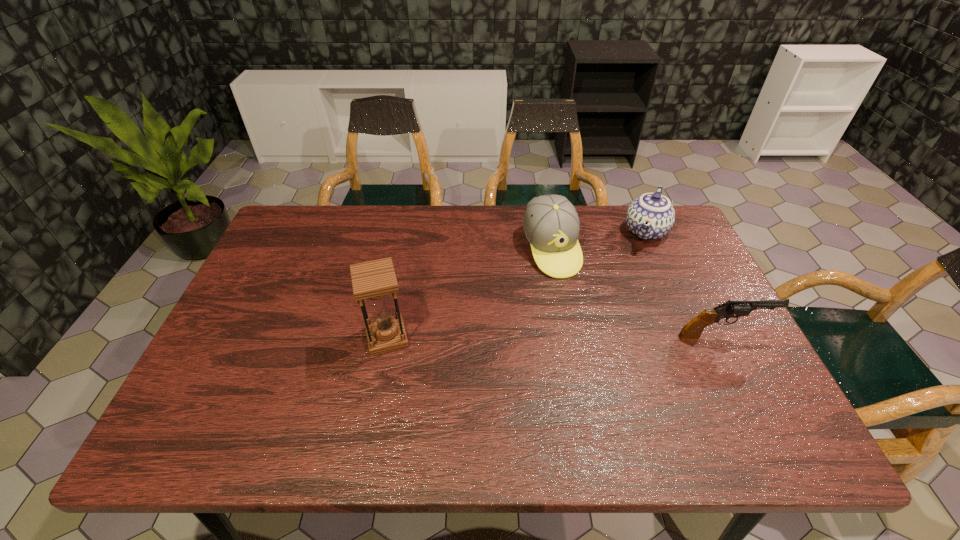
The height and width of the screenshot is (540, 960). What are the coordinates of `vacant space at the right edge of the desktop` in the screenshot? It's located at (681, 276).

At what (x,y) coordinates should I click in order to perform the action: click on vacant area at the far left corner of the desktop. Please return your answer as a coordinate pair (x, y). Looking at the image, I should click on (276, 252).

Identify the location of vacant space at the near left corner of the desktop. The width and height of the screenshot is (960, 540). (264, 375).

This screenshot has height=540, width=960. I want to click on free space between the baseball cap and the chinaware, so click(x=598, y=240).

You are a GUI agent. You are given a task and a screenshot of the screen. Output one action in this format:
    pyautogui.click(x=<x>, y=<y>)
    Task: Click on the free space between the gun and the tallest object
    Image resolution: width=960 pixels, height=540 pixels.
    Given the screenshot: What is the action you would take?
    pyautogui.click(x=555, y=337)

Find the location of a particular element. free space between the chinaware and the third object from right to left is located at coordinates (598, 240).

What are the coordinates of `free space between the tallest object and the third object from right to left` in the screenshot? It's located at (468, 293).

Identify the location of blank region between the gun and the second object from left to right. (636, 293).

Where is `vacant area between the chinaware and the leftmost object`? Image resolution: width=960 pixels, height=540 pixels. vacant area between the chinaware and the leftmost object is located at coordinates (516, 284).

Find the location of `vacant area between the gun and the tallest object`. vacant area between the gun and the tallest object is located at coordinates click(x=555, y=337).